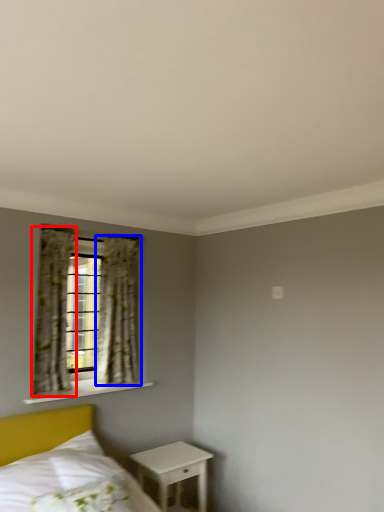
Question: Among these objects, which one is farthest to the camera, curtain (highlighted by a red box) or curtain (highlighted by a blue box)?

Choices:
 (A) curtain
 (B) curtain

Answer: (B)